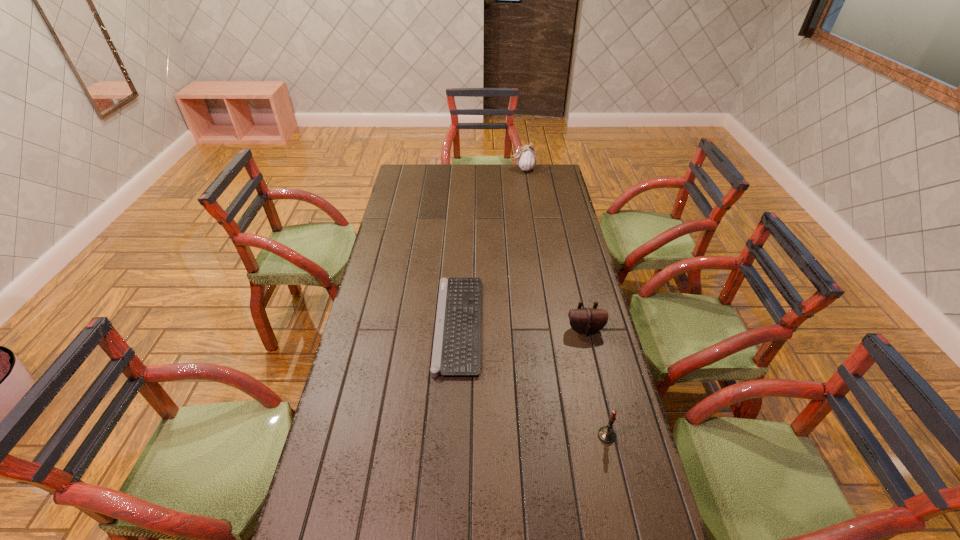
You are a GUI agent. You are given a task and a screenshot of the screen. Output one action in this format:
    pyautogui.click(x=<x>, y=<y>)
    Task: Click on the vacant area that lies between the farthest object and the shorter pouch
    
    Given the screenshot: What is the action you would take?
    pyautogui.click(x=554, y=249)

In order to click on the third closest object to the shortest object in this screenshot , I will do `click(526, 158)`.

Identify the location of object that stands as the closest to the right pouch. (456, 348).

Image resolution: width=960 pixels, height=540 pixels. In order to click on vacant space that satisfies the following two spatial constraints: 1. on the front-facing side of the farthest object; 2. on the front side of the shortest object in this screenshot , I will do `click(546, 324)`.

Identify the location of free location that satisfies the following two spatial constraints: 1. on the front-facing side of the farthest object; 2. on the left side of the nearest object. (563, 435).

Locate an element on the screen. vacant space that satisfies the following two spatial constraints: 1. on the front-facing side of the candle; 2. on the right side of the tallest object is located at coordinates (563, 435).

Locate an element on the screen. vacant point that satisfies the following two spatial constraints: 1. on the front-facing side of the farther pouch; 2. on the back side of the candle is located at coordinates (563, 435).

This screenshot has width=960, height=540. What are the coordinates of `free space that satisfies the following two spatial constraints: 1. on the front-facing side of the candle; 2. on the right side of the taller pouch` in the screenshot? It's located at (563, 435).